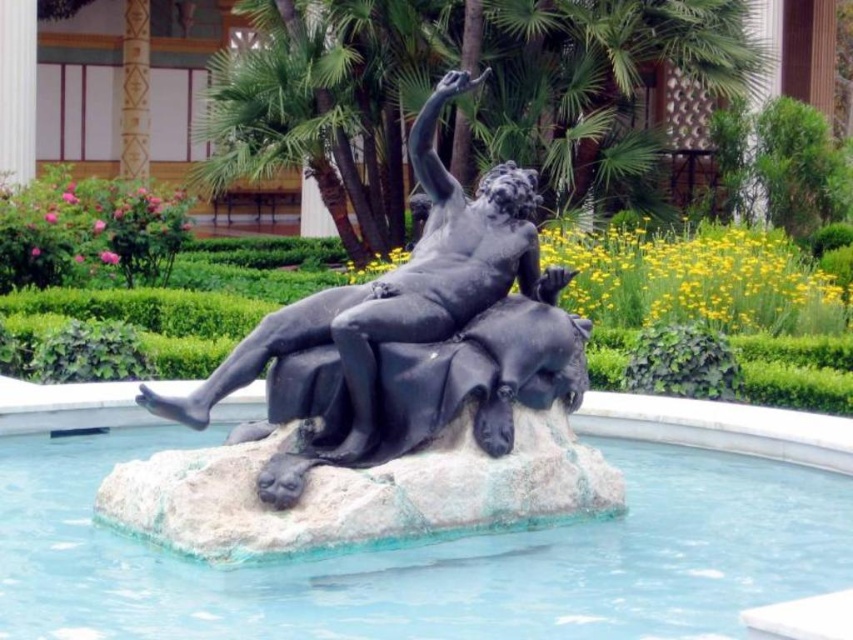
Question: Does green leafy palm tree at upper center appear on the left side of polished bronze statue at center?

Choices:
 (A) no
 (B) yes

Answer: (B)

Question: Which is nearer to the polished bronze statue at center?

Choices:
 (A) smooth stone pool at center
 (B) green leafy palm tree at upper center

Answer: (A)

Question: Is smooth stone pool at center above green leafy palm tree at upper center?

Choices:
 (A) yes
 (B) no

Answer: (B)

Question: Which point is closer to the camera taking this photo?

Choices:
 (A) (730, 570)
 (B) (381, 458)

Answer: (B)

Question: Can you confirm if green leafy palm tree at upper center is positioned below polished bronze statue at center?

Choices:
 (A) yes
 (B) no

Answer: (B)

Question: Which object is positioned closest to the green leafy palm tree at upper center?

Choices:
 (A) polished bronze statue at center
 (B) smooth stone pool at center

Answer: (B)